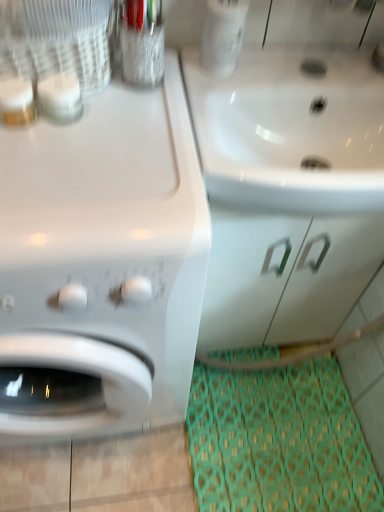
Question: From the image's perspective, is green fabric doormat at lower right located above white glossy sink at upper right?

Choices:
 (A) no
 (B) yes

Answer: (A)

Question: Is green fabric doormat at lower right smaller than white glossy sink at upper right?

Choices:
 (A) no
 (B) yes

Answer: (B)

Question: From a real-world perspective, does green fabric doormat at lower right stand above white glossy sink at upper right?

Choices:
 (A) yes
 (B) no

Answer: (B)

Question: Considering the relative sizes of green fabric doormat at lower right and white glossy sink at upper right in the image provided, is green fabric doormat at lower right bigger than white glossy sink at upper right?

Choices:
 (A) yes
 (B) no

Answer: (B)

Question: Does green fabric doormat at lower right have a lesser width compared to white glossy sink at upper right?

Choices:
 (A) no
 (B) yes

Answer: (A)

Question: Is green fabric doormat at lower right facing away from white glossy sink at upper right?

Choices:
 (A) no
 (B) yes

Answer: (A)

Question: Can you confirm if green fabric doormat at lower right is wider than white glossy drawer at center?

Choices:
 (A) no
 (B) yes

Answer: (B)

Question: Does green fabric doormat at lower right have a greater height compared to white glossy drawer at center?

Choices:
 (A) no
 (B) yes

Answer: (A)

Question: Considering the relative sizes of green fabric doormat at lower right and white glossy drawer at center in the image provided, is green fabric doormat at lower right thinner than white glossy drawer at center?

Choices:
 (A) yes
 (B) no

Answer: (B)

Question: Does green fabric doormat at lower right come in front of white glossy drawer at center?

Choices:
 (A) yes
 (B) no

Answer: (B)

Question: Does green fabric doormat at lower right have a larger size compared to white glossy drawer at center?

Choices:
 (A) no
 (B) yes

Answer: (A)

Question: From the image's perspective, is green fabric doormat at lower right under white glossy drawer at center?

Choices:
 (A) no
 (B) yes

Answer: (B)

Question: Is white glossy drawer at center outside white glossy washing machine at left?

Choices:
 (A) no
 (B) yes

Answer: (B)